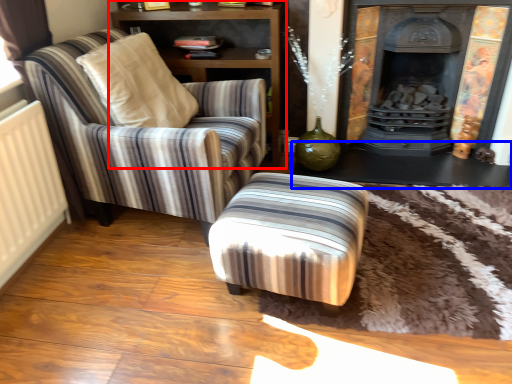
Question: Which object appears farthest to the camera in this image, shelf (highlighted by a red box) or table (highlighted by a blue box)?

Choices:
 (A) shelf
 (B) table

Answer: (B)